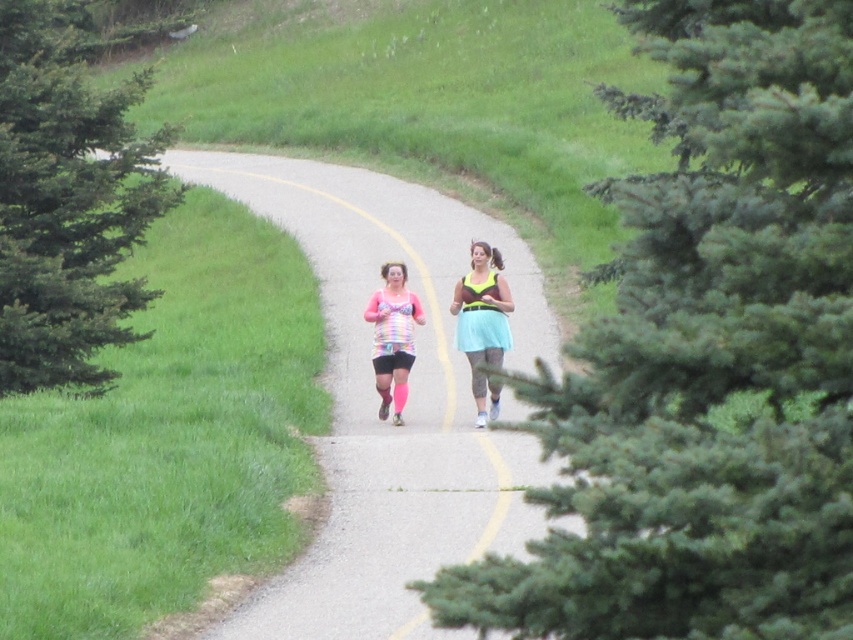
You are a drone operator trying to capture a photo of the two joggers on the path. The green textured pine at center right is blocking your view. Can you adjust your position to the left or right to avoid it?

The green textured pine at center right is located at point (704, 358). To avoid the obstruction, move your drone to the left side of the path to capture the joggers without the pine blocking the view.